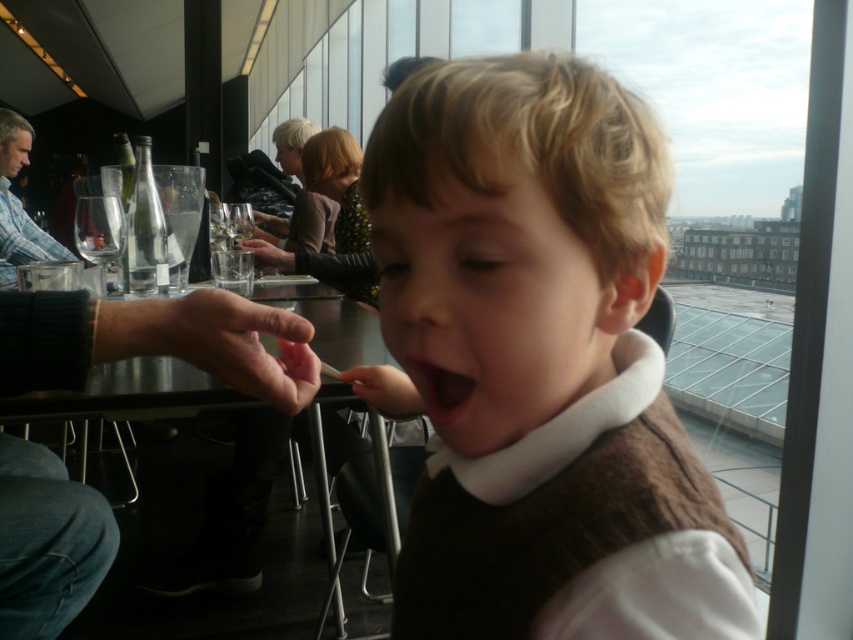
Question: Which object appears closest to the camera in this image?

Choices:
 (A) black matte mouth at center
 (B) metallic silver table at center
 (C) brown fuzzy vest at center
 (D) plaid shirt at left

Answer: (C)

Question: Where is brown fuzzy vest at center located in relation to metallic silver table at center in the image?

Choices:
 (A) below
 (B) above

Answer: (B)

Question: Is metallic silver table at center positioned in front of transparent glass wine glass at upper left?

Choices:
 (A) yes
 (B) no

Answer: (A)

Question: Estimate the real-world distances between objects in this image. Which object is farther from the metallic silver table at center?

Choices:
 (A) transparent glass wine glass at upper left
 (B) brown fuzzy vest at center
 (C) black matte mouth at center

Answer: (C)

Question: Does metallic silver table at center appear on the right side of black matte mouth at center?

Choices:
 (A) no
 (B) yes

Answer: (A)

Question: Which of the following is the farthest from the observer?

Choices:
 (A) transparent glass wine glass at upper left
 (B) black matte mouth at center
 (C) plaid shirt at left

Answer: (C)